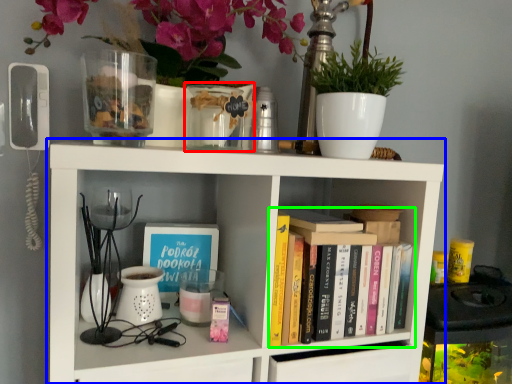
Question: Which is farther away from glass vase (highlighted by a red box)? shelf (highlighted by a blue box) or book (highlighted by a green box)?

Choices:
 (A) shelf
 (B) book

Answer: (B)